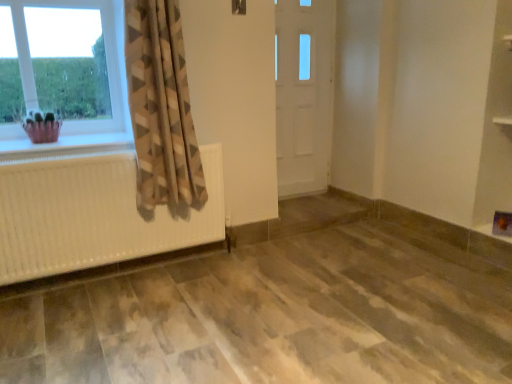
Question: From the image's perspective, does white textured radiator at left appear higher than clear glass window at upper left?

Choices:
 (A) no
 (B) yes

Answer: (A)

Question: Does white textured radiator at left have a greater width compared to clear glass window at upper left?

Choices:
 (A) no
 (B) yes

Answer: (A)

Question: Can you confirm if white textured radiator at left is taller than clear glass window at upper left?

Choices:
 (A) no
 (B) yes

Answer: (A)

Question: Is white textured radiator at left bigger than clear glass window at upper left?

Choices:
 (A) no
 (B) yes

Answer: (B)

Question: Is white textured radiator at left not within clear glass window at upper left?

Choices:
 (A) no
 (B) yes

Answer: (B)

Question: From a real-world perspective, is white textured radiator at left beneath clear glass window at upper left?

Choices:
 (A) yes
 (B) no

Answer: (A)

Question: Can you confirm if white textured radiator at left is shorter than pink fabric basket at left?

Choices:
 (A) yes
 (B) no

Answer: (A)

Question: Is white textured radiator at left further to the viewer compared to pink fabric basket at left?

Choices:
 (A) yes
 (B) no

Answer: (B)

Question: Does white textured radiator at left have a smaller size compared to pink fabric basket at left?

Choices:
 (A) no
 (B) yes

Answer: (A)

Question: From a real-world perspective, is white textured radiator at left on pink fabric basket at left?

Choices:
 (A) yes
 (B) no

Answer: (B)

Question: From the image's perspective, is white textured radiator at left below pink fabric basket at left?

Choices:
 (A) yes
 (B) no

Answer: (A)

Question: Is pink fabric basket at left inside white textured radiator at left?

Choices:
 (A) yes
 (B) no

Answer: (B)

Question: Is beige textured curtain at left at the back of white wooden door at center?

Choices:
 (A) yes
 (B) no

Answer: (B)